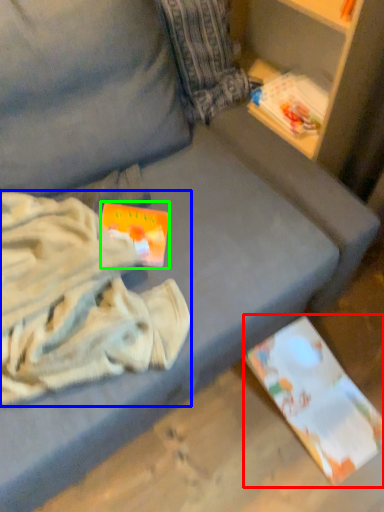
Question: Which object is positioned closest to paperback book (highlighted by a red box)? Select from clothing (highlighted by a blue box) and paperback book (highlighted by a green box).

Choices:
 (A) clothing
 (B) paperback book

Answer: (A)